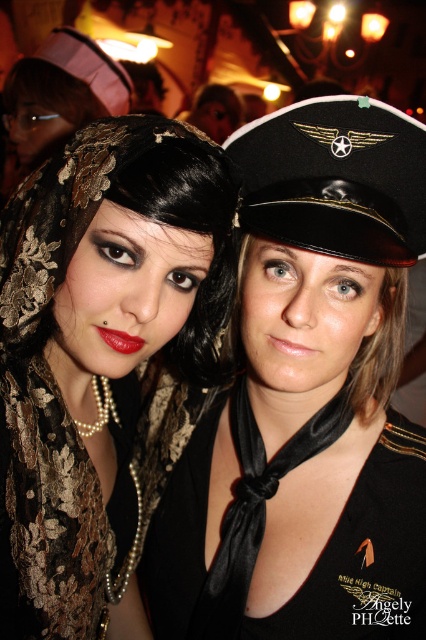
Is black satin scarf at center below gold lace dress at center?

Incorrect, black satin scarf at center is not positioned below gold lace dress at center.

Does black satin scarf at center appear over gold lace dress at center?

Yes, black satin scarf at center is above gold lace dress at center.

Describe the element at coordinates (307, 397) in the screenshot. I see `black satin scarf at center` at that location.

The width and height of the screenshot is (426, 640). Identify the location of black satin scarf at center. (307, 397).

Does black leather cap at center appear on the left side of pink fabric hat at upper left?

No, black leather cap at center is not to the left of pink fabric hat at upper left.

Does point (363, 198) come farther from viewer compared to point (117, 92)?

No.

Where is `black leather cap at center`? This screenshot has height=640, width=426. black leather cap at center is located at coordinates (334, 179).

Can you confirm if gold lace dress at center is shorter than pink fabric hat at upper left?

No, gold lace dress at center is not shorter than pink fabric hat at upper left.

Consider the image. Between gold lace dress at center and pink fabric hat at upper left, which one appears on the left side from the viewer's perspective?

pink fabric hat at upper left is more to the left.

Who is more forward, (17,474) or (81,68)?

Positioned in front is point (17,474).

Where is `gold lace dress at center`? Image resolution: width=426 pixels, height=640 pixels. gold lace dress at center is located at coordinates (57, 508).